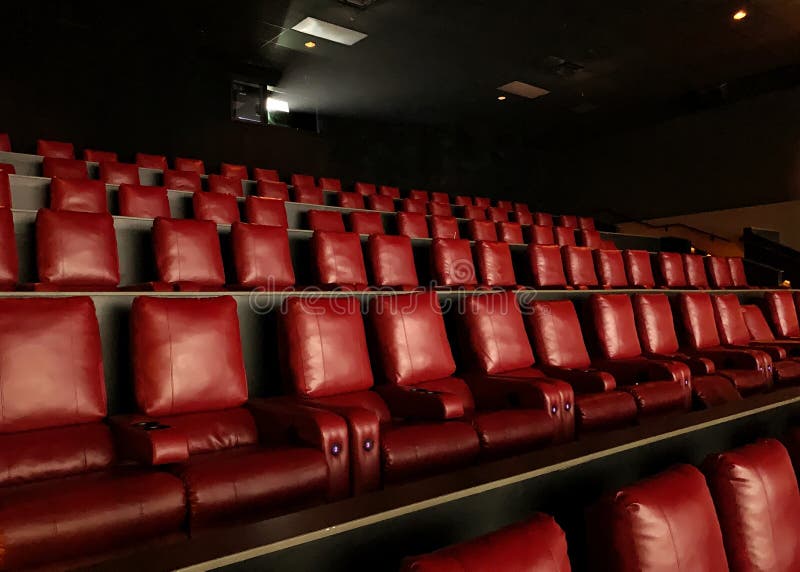
Identify the location of light. This screenshot has width=800, height=572. (292, 109), (334, 31), (529, 85), (736, 11), (502, 99).